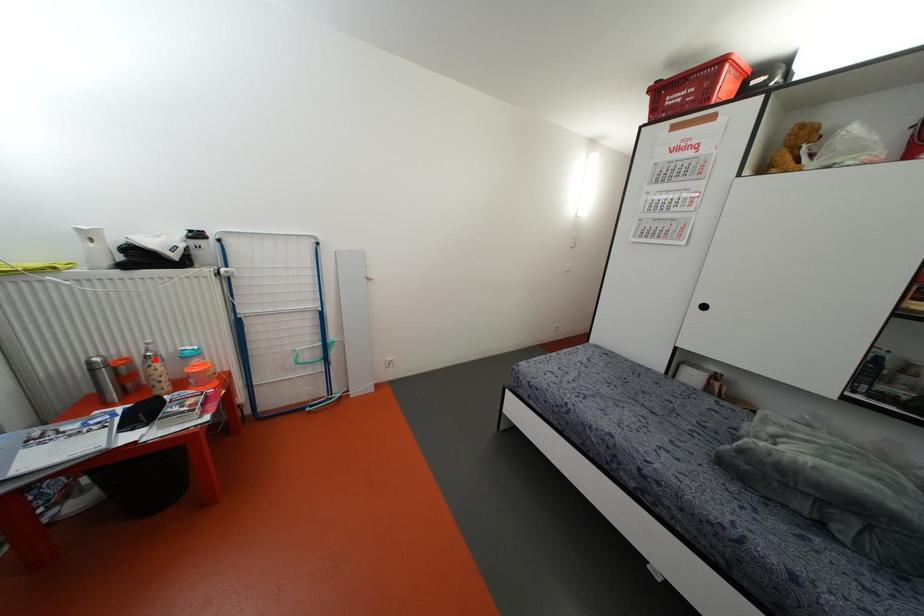
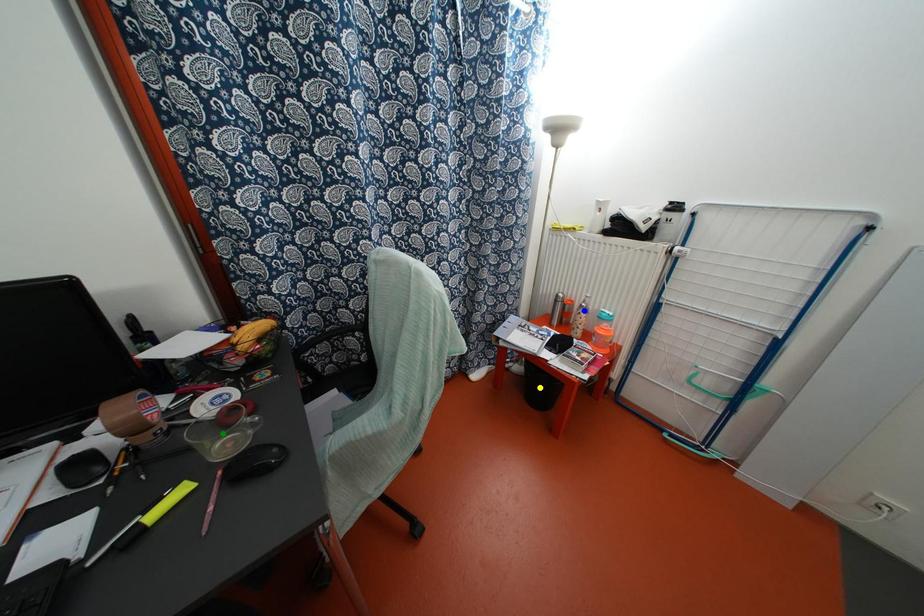
Question: I am providing you with two images of the same scene from different viewpoints. A red point is marked on the first image. You are given multiple points on the second image. Which point in image 2 is actually the same real-world point as the red point in image 1?

Choices:
 (A) yellow point
 (B) blue point
 (C) green point

Answer: (B)